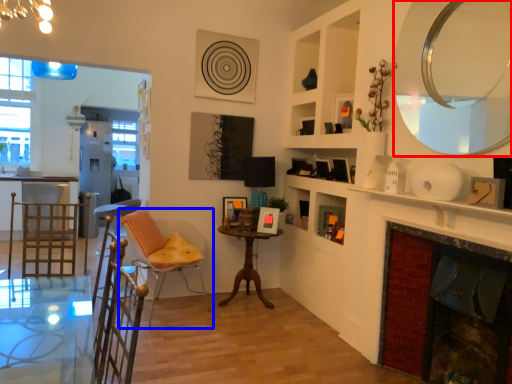
Question: Which object is closer to the camera taking this photo, mirror (highlighted by a red box) or chair (highlighted by a blue box)?

Choices:
 (A) mirror
 (B) chair

Answer: (A)